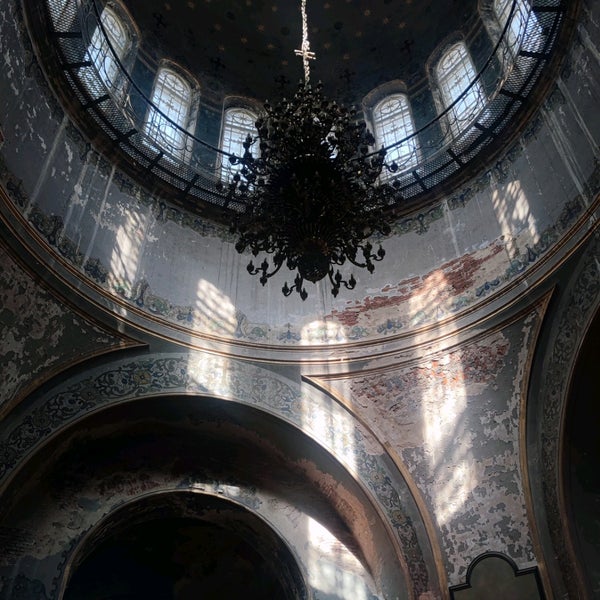
Image resolution: width=600 pixels, height=600 pixels. What are the coordinates of `bulb` in the screenshot? It's located at (315, 270).